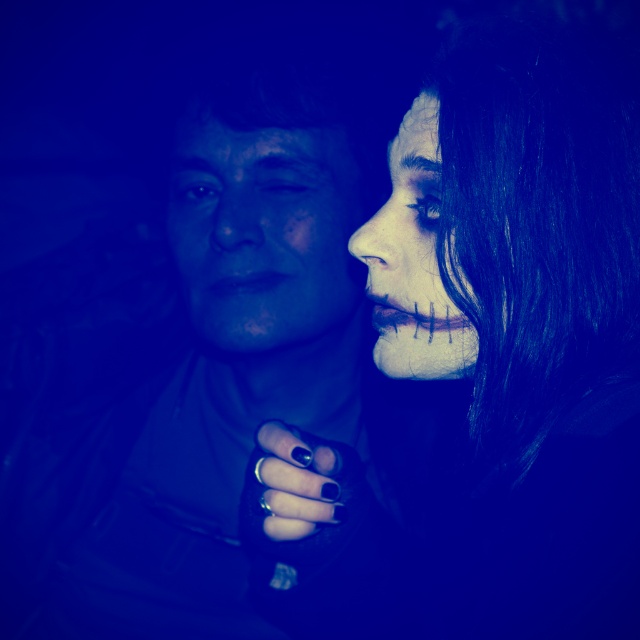
Is matte black jacket at center to the right of matte black face at center from the viewer's perspective?

Incorrect, matte black jacket at center is not on the right side of matte black face at center.

Can you confirm if matte black jacket at center is thinner than matte black face at center?

No.

The width and height of the screenshot is (640, 640). I want to click on matte black jacket at center, so click(x=182, y=374).

Does matte black face paint at right lie in front of matte white face at right?

That is True.

Who is positioned more to the left, matte black face paint at right or matte white face at right?

From the viewer's perspective, matte white face at right appears more on the left side.

Describe the element at coordinates (483, 368) in the screenshot. I see `matte black face paint at right` at that location.

Where is `matte black face paint at right`? The width and height of the screenshot is (640, 640). matte black face paint at right is located at coordinates (483, 368).

From the picture: Does matte black face at center have a greater width compared to matte white face at right?

Indeed, matte black face at center has a greater width compared to matte white face at right.

Measure the distance between matte black face at center and camera.

A distance of 73.54 centimeters exists between matte black face at center and camera.

Which is in front, point (316, 209) or point (400, 145)?

Point (400, 145) is more forward.

Locate an element on the screen. The width and height of the screenshot is (640, 640). matte black face at center is located at coordinates (260, 232).